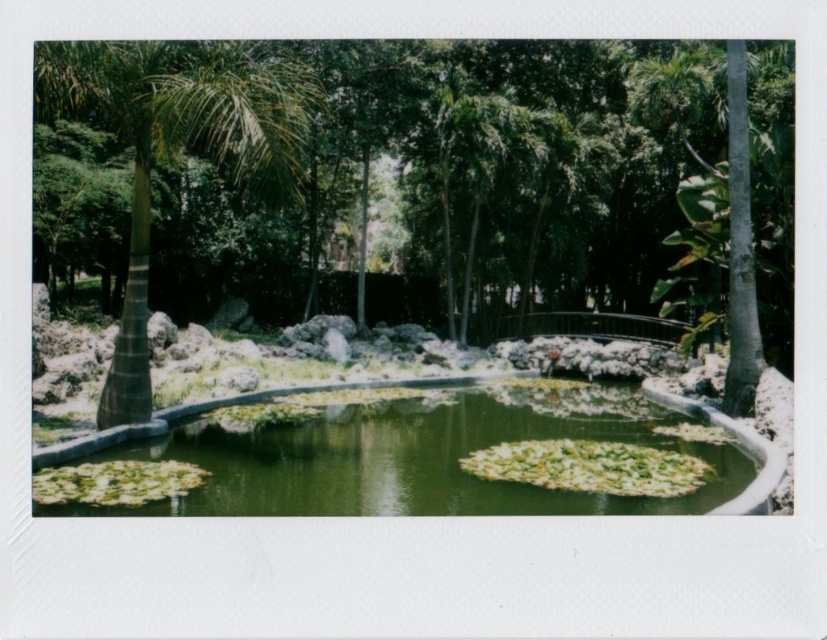
Does point (375, 465) come closer to viewer compared to point (257, 108)?

No, (375, 465) is further to viewer.

Identify the location of green mossy pond at center. tap(418, 456).

Between point (36, 157) and point (601, 486), which one is positioned behind?

The point (36, 157) is more distant.

This screenshot has width=827, height=640. I want to click on green leafy tree at center, so click(443, 184).

Is point (548, 152) farther from viewer compared to point (238, 115)?

Yes, point (548, 152) is behind point (238, 115).

Is green leafy tree at center positioned at the back of green leafy palm tree at left?

No, it is in front of green leafy palm tree at left.

The height and width of the screenshot is (640, 827). I want to click on green leafy tree at center, so click(443, 184).